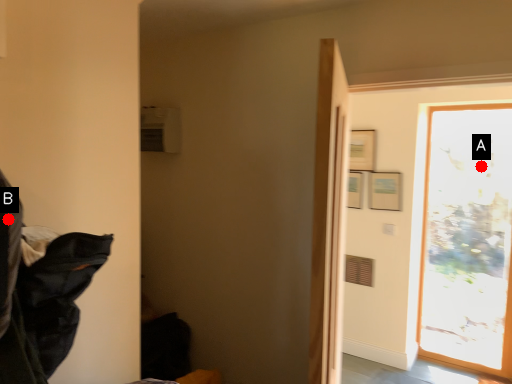
Question: Two points are circled on the image, labeled by A and B beside each circle. Which point is closer to the camera?

Choices:
 (A) A is closer
 (B) B is closer

Answer: (B)